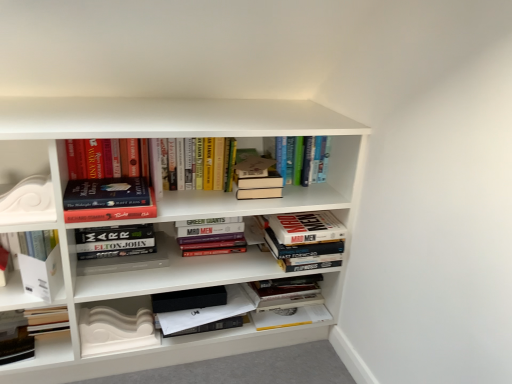
Question: From a real-world perspective, is white glossy decorative element at left over hardcover book at center, acting as the fourth book starting from the left?

Choices:
 (A) no
 (B) yes

Answer: (B)

Question: Is white glossy decorative element at left looking in the opposite direction of hardcover book at center, the 3th book positioned from the right?

Choices:
 (A) no
 (B) yes

Answer: (A)

Question: Is white glossy decorative element at left smaller than hardcover book at center, the 3th book positioned from the right?

Choices:
 (A) yes
 (B) no

Answer: (A)

Question: Is white glossy decorative element at left at the left side of hardcover book at center, the 3th book positioned from the right?

Choices:
 (A) yes
 (B) no

Answer: (A)

Question: Does white glossy decorative element at left touch hardcover book at center, the 3th book positioned from the right?

Choices:
 (A) no
 (B) yes

Answer: (A)

Question: Does white glossy decorative element at left have a greater height compared to hardcover book at center, the 3th book positioned from the right?

Choices:
 (A) yes
 (B) no

Answer: (B)

Question: Would you say hardcover book at upper left, the fifth book viewed from the right, is part of hardcover book at center, which appears as the 2th book when viewed from the right,'s contents?

Choices:
 (A) no
 (B) yes

Answer: (A)

Question: Considering the relative sizes of hardcover book at center, the fifth book in the left-to-right sequence, and hardcover book at upper left, the fifth book viewed from the right, in the image provided, is hardcover book at center, the fifth book in the left-to-right sequence, taller than hardcover book at upper left, the fifth book viewed from the right,?

Choices:
 (A) no
 (B) yes

Answer: (B)

Question: Considering the relative sizes of hardcover book at center, the fifth book in the left-to-right sequence, and hardcover book at upper left, arranged as the second book when viewed from the left, in the image provided, is hardcover book at center, the fifth book in the left-to-right sequence, thinner than hardcover book at upper left, arranged as the second book when viewed from the left,?

Choices:
 (A) yes
 (B) no

Answer: (B)

Question: Is the depth of hardcover book at center, which appears as the 2th book when viewed from the right, greater than that of hardcover book at upper left, the fifth book viewed from the right?

Choices:
 (A) yes
 (B) no

Answer: (A)

Question: Can you confirm if hardcover book at center, which appears as the 2th book when viewed from the right, is positioned to the right of hardcover book at upper left, arranged as the second book when viewed from the left?

Choices:
 (A) no
 (B) yes

Answer: (B)

Question: Does hardcover book at center, which appears as the 2th book when viewed from the right, have a lesser height compared to hardcover book at upper left, the fifth book viewed from the right?

Choices:
 (A) yes
 (B) no

Answer: (B)

Question: Is hardcover book at center, which appears as the 2th book when viewed from the right, located within white glossy decorative element at left?

Choices:
 (A) no
 (B) yes

Answer: (A)